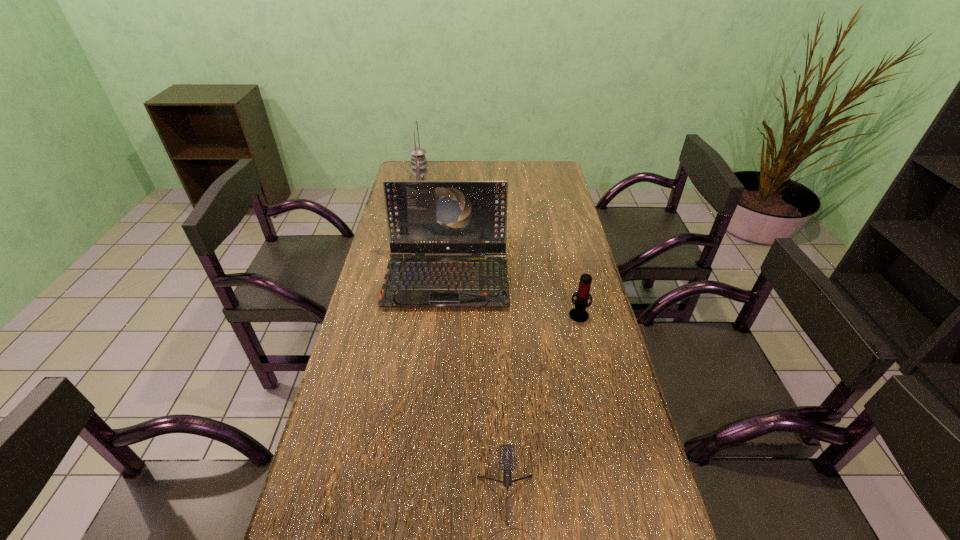
You are a GUI agent. You are given a task and a screenshot of the screen. Output one action in this format:
    pyautogui.click(x=<x>, y=<y>)
    Task: Click on the tallest object
    The height and width of the screenshot is (540, 960).
    Given the screenshot: What is the action you would take?
    pyautogui.click(x=419, y=172)

This screenshot has height=540, width=960. Identify the location of oil lamp. (419, 172).

In order to click on laptop computer in this screenshot , I will do `click(423, 217)`.

Where is `the rightmost object`? This screenshot has width=960, height=540. the rightmost object is located at coordinates [579, 314].

Identify the location of the taller microphone. The width and height of the screenshot is (960, 540). (579, 314).

Image resolution: width=960 pixels, height=540 pixels. Find the location of `vacant region located on the front of the farthest object`. vacant region located on the front of the farthest object is located at coordinates (411, 266).

Locate an element on the screen. free spot located 0.250m on the screen of the laptop computer is located at coordinates (438, 379).

This screenshot has height=540, width=960. I want to click on free space located 0.070m on the left of the farther microphone, so click(545, 314).

Find the location of `oil lamp that is at the left edge`. oil lamp that is at the left edge is located at coordinates (419, 172).

At what (x,y) coordinates should I click in order to perform the action: click on laptop computer that is at the left edge. Please return your answer as a coordinate pair (x, y). This screenshot has height=540, width=960. Looking at the image, I should click on (423, 217).